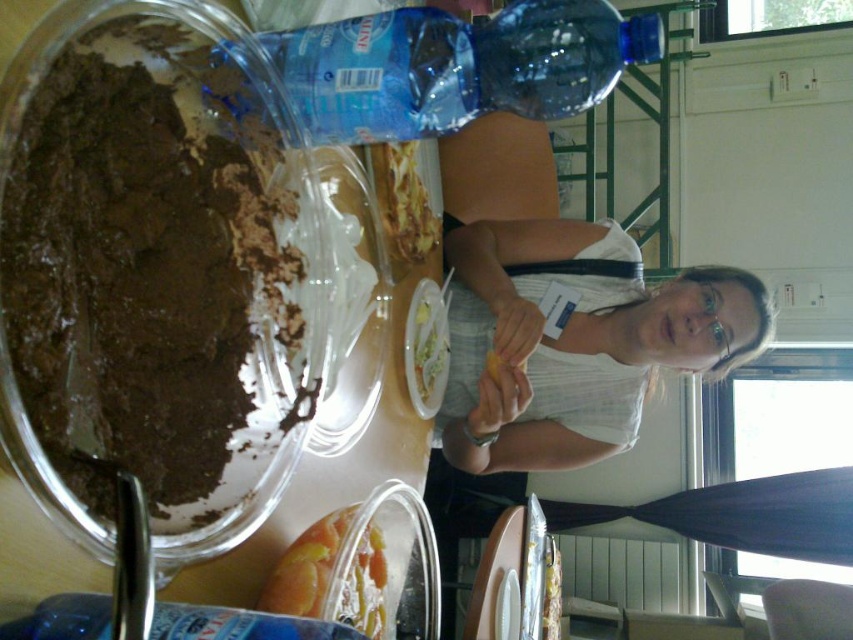
Question: Observing the image, what is the correct spatial positioning of white fabric shirt at upper right in reference to blue plastic bottle at lower left?

Choices:
 (A) right
 (B) left

Answer: (A)

Question: Where is white fabric shirt at upper right located in relation to transparent plastic goggles at upper center in the image?

Choices:
 (A) left
 (B) right

Answer: (A)

Question: Which of the following is the closest to the observer?

Choices:
 (A) (201, 472)
 (B) (645, 49)
 (C) (158, 612)

Answer: (C)

Question: Among these points, which one is farthest from the camera?

Choices:
 (A) (529, 54)
 (B) (274, 624)
 (C) (514, 230)
 (D) (706, 304)

Answer: (C)

Question: Can you confirm if dark matte chocolate cake at left is positioned to the left of transparent plastic goggles at upper center?

Choices:
 (A) yes
 (B) no

Answer: (A)

Question: Which object is farther from the camera taking this photo?

Choices:
 (A) translucent plastic container at lower center
 (B) blue plastic bottle at lower left
 (C) dark matte chocolate cake at left

Answer: (A)